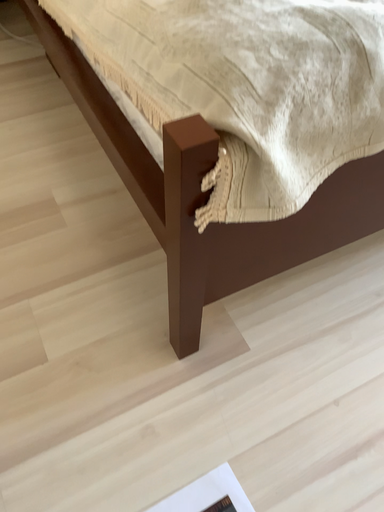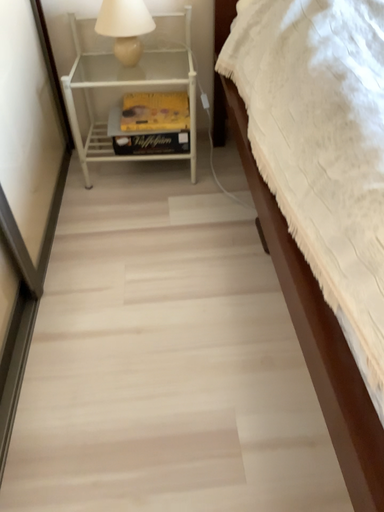
Question: How did the camera likely rotate when shooting the video?

Choices:
 (A) rotated left
 (B) rotated right

Answer: (A)